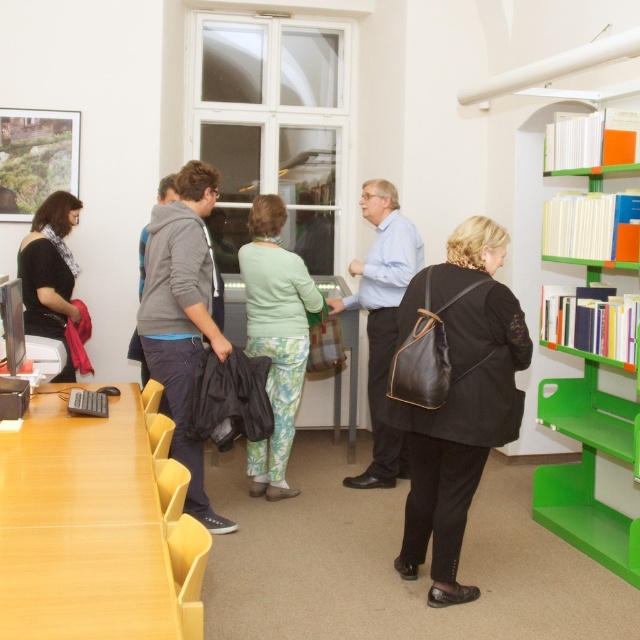
Is matte black jacket at left wider than gray fleece jacket at center?

In fact, matte black jacket at left might be narrower than gray fleece jacket at center.

What do you see at coordinates (49, 273) in the screenshot? I see `matte black jacket at left` at bounding box center [49, 273].

At what (x,y) coordinates should I click in order to perform the action: click on matte black jacket at left. Please return your answer as a coordinate pair (x, y). Looking at the image, I should click on (49, 273).

Based on the photo, is matte black jacket at left above orange matte book at upper right?

No.

Can you confirm if matte black jacket at left is taller than orange matte book at upper right?

Indeed, matte black jacket at left has a greater height compared to orange matte book at upper right.

You are a GUI agent. You are given a task and a screenshot of the screen. Output one action in this format:
    pyautogui.click(x=<x>, y=<y>)
    Task: Click on the matte black jacket at left
    
    Given the screenshot: What is the action you would take?
    pyautogui.click(x=49, y=273)

In the scene shown: Is light blue shirt at center in front of hardcover book at right?

No, light blue shirt at center is further to the viewer.

Is point (380, 289) closer to viewer compared to point (584, 202)?

No.

The image size is (640, 640). Find the location of `light blue shirt at center`. light blue shirt at center is located at coordinates (381, 317).